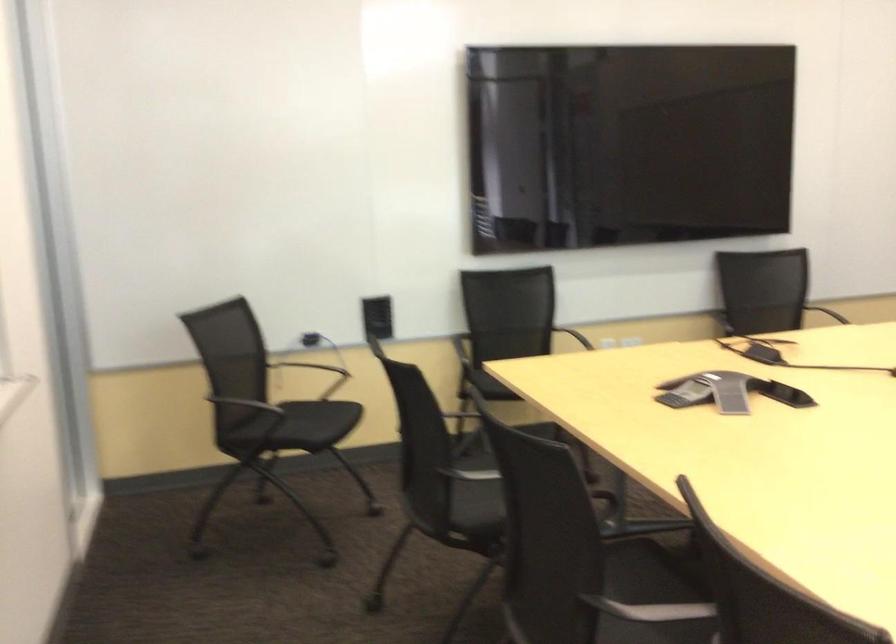
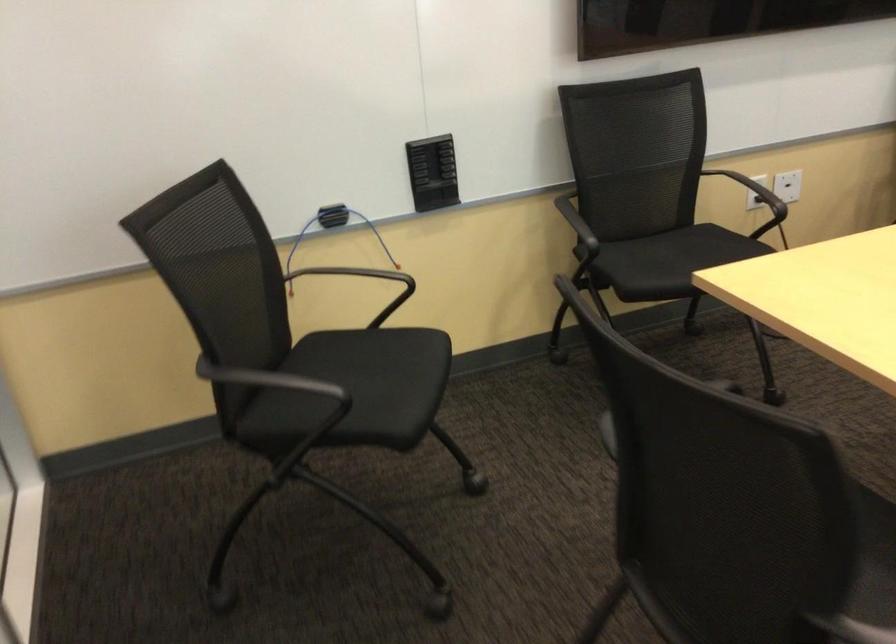
Question: What movement of the cameraman would produce the second image?

Choices:
 (A) Left
 (B) Right
 (C) Forward
 (D) Backward

Answer: (C)